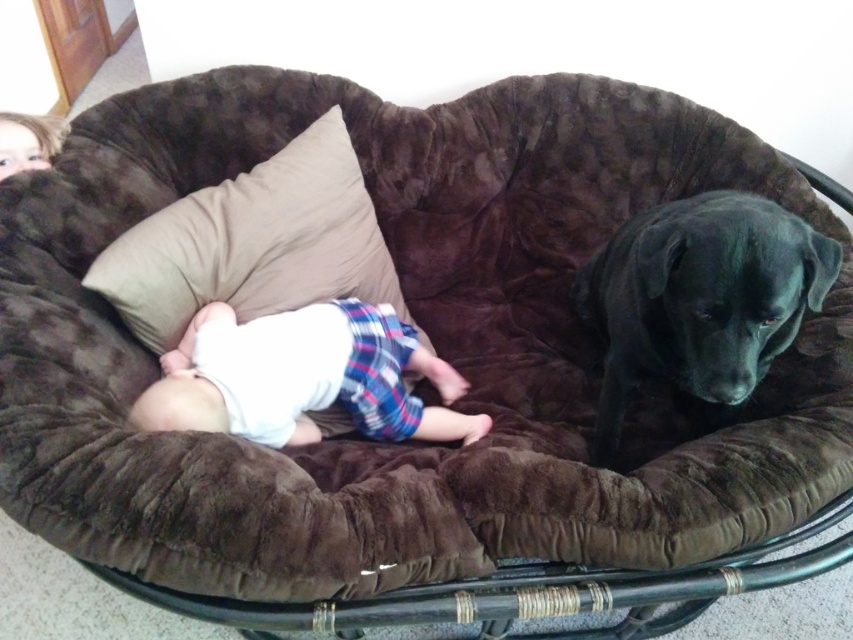
Question: Which point appears closest to the camera in this image?

Choices:
 (A) (268, 202)
 (B) (283, 349)
 (C) (810, 272)

Answer: (C)

Question: In this image, where is beige fabric pillow at center located relative to white soft cloth at center?

Choices:
 (A) below
 (B) above

Answer: (B)

Question: Which object is the farthest from the white soft cloth at center?

Choices:
 (A) beige fabric pillow at center
 (B) black velvet dog at upper right

Answer: (B)

Question: Which object is closer to the camera taking this photo?

Choices:
 (A) white soft cloth at center
 (B) black velvet dog at upper right

Answer: (B)

Question: Is beige fabric pillow at center thinner than white soft cloth at center?

Choices:
 (A) no
 (B) yes

Answer: (B)

Question: Can you confirm if black velvet dog at upper right is positioned to the right of white soft cloth at center?

Choices:
 (A) no
 (B) yes

Answer: (B)